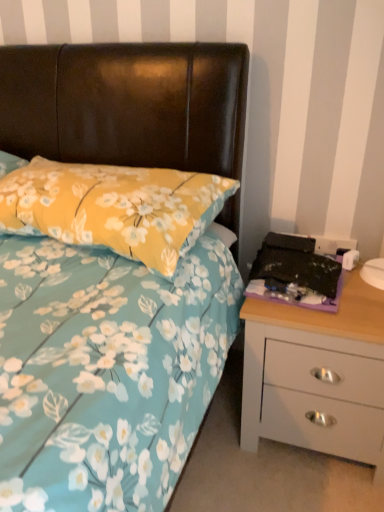
Question: Considering the positions of white matte chest of drawers at right and yellow floral pillow at upper left in the image, is white matte chest of drawers at right taller or shorter than yellow floral pillow at upper left?

Choices:
 (A) tall
 (B) short

Answer: (A)

Question: Looking at the image, does white matte chest of drawers at right seem bigger or smaller compared to yellow floral pillow at upper left?

Choices:
 (A) small
 (B) big

Answer: (B)

Question: Is point (370, 390) closer or farther from the camera than point (61, 166)?

Choices:
 (A) closer
 (B) farther

Answer: (A)

Question: Is yellow floral pillow at upper left to the left or to the right of white matte chest of drawers at right in the image?

Choices:
 (A) left
 (B) right

Answer: (A)

Question: Is yellow floral pillow at upper left bigger or smaller than white matte chest of drawers at right?

Choices:
 (A) big
 (B) small

Answer: (B)

Question: Is point (162, 233) closer or farther from the camera than point (357, 436)?

Choices:
 (A) closer
 (B) farther

Answer: (A)

Question: In terms of height, does yellow floral pillow at upper left look taller or shorter compared to white matte chest of drawers at right?

Choices:
 (A) tall
 (B) short

Answer: (B)